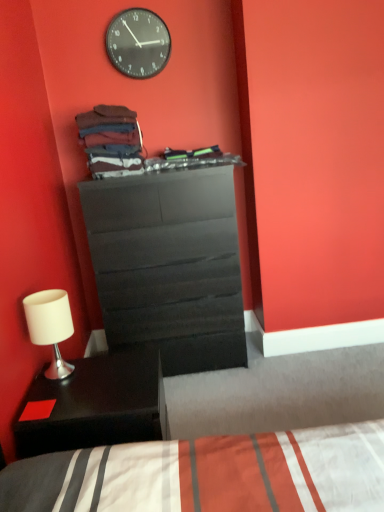
Question: Is matte black dresser at center positioned behind black glass clock at upper center?

Choices:
 (A) yes
 (B) no

Answer: (B)

Question: Can you confirm if matte black dresser at center is taller than black glass clock at upper center?

Choices:
 (A) yes
 (B) no

Answer: (A)

Question: From the image's perspective, is matte black dresser at center located beneath black glass clock at upper center?

Choices:
 (A) yes
 (B) no

Answer: (A)

Question: Is matte black dresser at center oriented towards black glass clock at upper center?

Choices:
 (A) no
 (B) yes

Answer: (A)

Question: Is matte black dresser at center wider than black glass clock at upper center?

Choices:
 (A) no
 (B) yes

Answer: (B)

Question: In terms of size, does black glass clock at upper center appear bigger or smaller than matte black dresser at center?

Choices:
 (A) small
 (B) big

Answer: (A)

Question: Do you think black glass clock at upper center is within matte black dresser at center, or outside of it?

Choices:
 (A) inside
 (B) outside

Answer: (B)

Question: From a real-world perspective, is black glass clock at upper center positioned above or below matte black dresser at center?

Choices:
 (A) below
 (B) above

Answer: (B)

Question: Is black glass clock at upper center to the left or to the right of matte black dresser at center in the image?

Choices:
 (A) right
 (B) left

Answer: (B)

Question: From the image's perspective, is matte black dresser at center above or below white matte table lamp at lower left?

Choices:
 (A) below
 (B) above

Answer: (B)

Question: Is matte black dresser at center situated inside white matte table lamp at lower left or outside?

Choices:
 (A) outside
 (B) inside

Answer: (A)

Question: Looking at the image, does matte black dresser at center seem bigger or smaller compared to white matte table lamp at lower left?

Choices:
 (A) big
 (B) small

Answer: (A)

Question: Is matte black dresser at center in front of or behind white matte table lamp at lower left in the image?

Choices:
 (A) front
 (B) behind

Answer: (B)

Question: Considering the positions of point (18, 455) and point (190, 300), is point (18, 455) closer or farther from the camera than point (190, 300)?

Choices:
 (A) closer
 (B) farther

Answer: (A)

Question: Considering their positions, is black matte nightstand at lower left located in front of or behind matte black dresser at center?

Choices:
 (A) front
 (B) behind

Answer: (A)